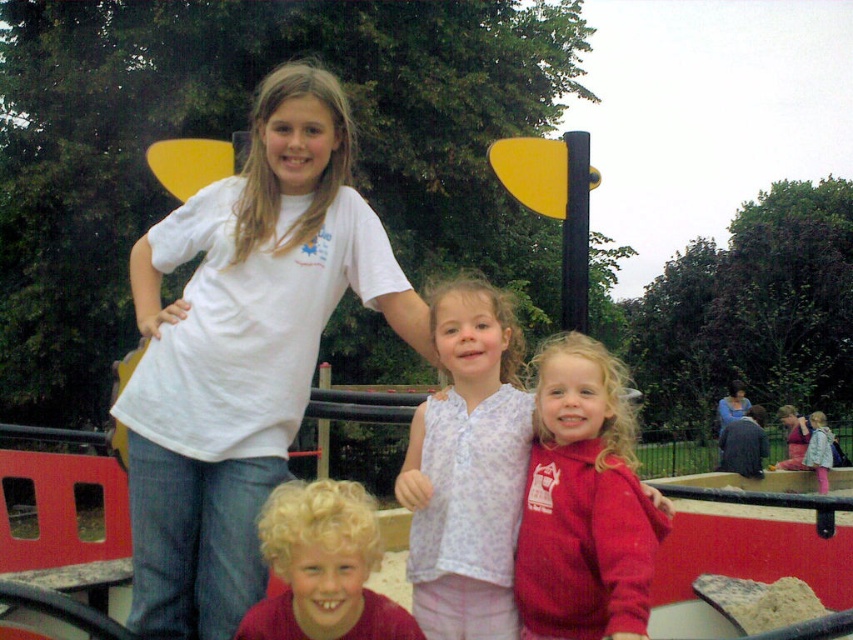
Which is more to the right, red fleece jacket at center or curly blonde hair at center?

From the viewer's perspective, red fleece jacket at center appears more on the right side.

Between red fleece jacket at center and curly blonde hair at center, which one is positioned higher?

red fleece jacket at center

The width and height of the screenshot is (853, 640). What do you see at coordinates (584, 502) in the screenshot?
I see `red fleece jacket at center` at bounding box center [584, 502].

The height and width of the screenshot is (640, 853). I want to click on red fleece jacket at center, so click(584, 502).

Is light purple fabric shirt at center smaller than curly blonde hair at center?

Yes, light purple fabric shirt at center is smaller than curly blonde hair at center.

Does point (482, 392) come behind point (296, 596)?

That is True.

Is point (521, 408) positioned before point (396, 616)?

No, it is not.

You are a GUI agent. You are given a task and a screenshot of the screen. Output one action in this format:
    pyautogui.click(x=<x>, y=<y>)
    Task: Click on the light purple fabric shirt at center
    The height and width of the screenshot is (640, 853).
    Given the screenshot: What is the action you would take?
    point(467,468)

Which is above, white matte t-shirt at upper left or red fleece jacket at center?

white matte t-shirt at upper left

Does white matte t-shirt at upper left have a greater height compared to red fleece jacket at center?

Indeed, white matte t-shirt at upper left has a greater height compared to red fleece jacket at center.

Is point (144, 538) farther from camera compared to point (599, 604)?

That is True.

Image resolution: width=853 pixels, height=640 pixels. I want to click on white matte t-shirt at upper left, so click(x=242, y=349).